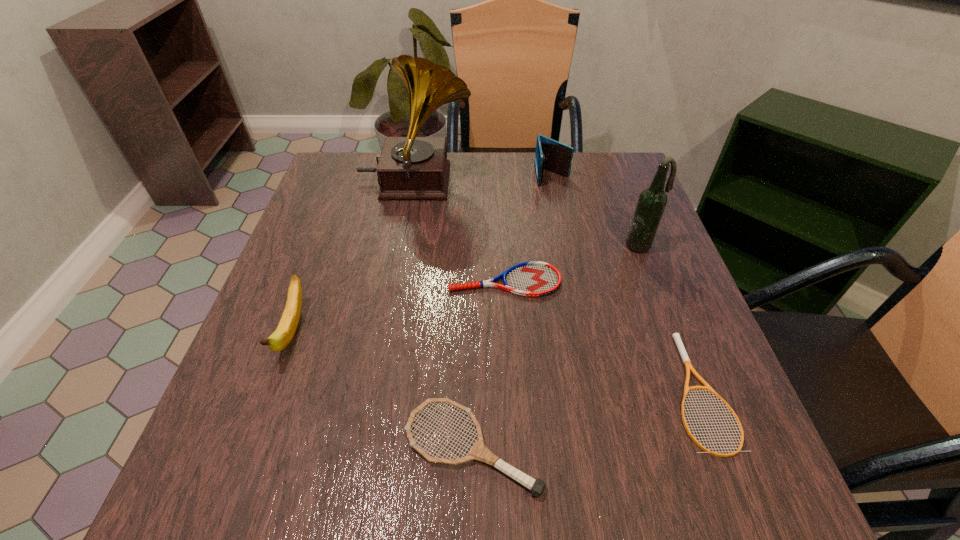
Locate an element on the screen. This screenshot has height=540, width=960. free space located on the back of the third farthest object is located at coordinates (626, 205).

At what (x,y) coordinates should I click in order to perform the action: click on free location located on the exterior surface of the wallet. Please return your answer as a coordinate pair (x, y). The height and width of the screenshot is (540, 960). Looking at the image, I should click on (564, 235).

Find the location of a particular element. vacant space located 0.210m at the stem of the leftmost object is located at coordinates (229, 503).

Locate an element on the screen. This screenshot has width=960, height=540. free location located on the left of the fifth tallest object is located at coordinates (302, 448).

The image size is (960, 540). What are the coordinates of `vacant area located on the front of the farthest tennis racket` in the screenshot? It's located at (511, 384).

Locate an element on the screen. vacant area situated 0.070m on the back of the shortest object is located at coordinates (666, 307).

This screenshot has height=540, width=960. Find the location of `phonograph record that is at the far edge`. phonograph record that is at the far edge is located at coordinates click(x=411, y=167).

You are a GUI agent. You are given a task and a screenshot of the screen. Output one action in this format:
    pyautogui.click(x=<x>, y=<y>)
    Task: Click on the wallet present at the far edge
    The height and width of the screenshot is (540, 960).
    Given the screenshot: What is the action you would take?
    551,155

The image size is (960, 540). Identify the location of phonograph record present at the left edge. (411, 167).

Locate an element on the screen. The width and height of the screenshot is (960, 540). banana located at the left edge is located at coordinates coord(283,335).